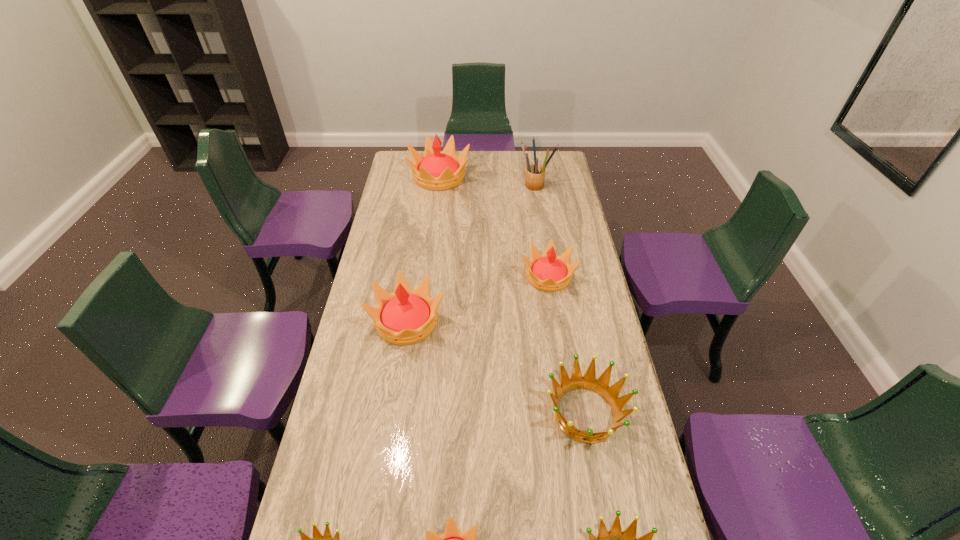
The width and height of the screenshot is (960, 540). Find the location of `the tallest crown`. the tallest crown is located at coordinates (435, 170).

This screenshot has width=960, height=540. I want to click on the farthest crown, so click(435, 170).

Locate an element on the screen. This screenshot has width=960, height=540. brown pencil box is located at coordinates (535, 174).

Where is `the third tallest object`? the third tallest object is located at coordinates (406, 316).

Locate an element on the screen. the second tallest crown is located at coordinates (406, 316).

Locate an element on the screen. The width and height of the screenshot is (960, 540). the rightmost yellow crown is located at coordinates (548, 272).

I want to click on the third tallest crown, so click(548, 272).

I want to click on the fourth nearest crown, so click(600, 386).

I want to click on the biggest golden crown, so click(600, 386).

The width and height of the screenshot is (960, 540). Identify the location of vacant point located on the front of the tallest crown. (432, 234).